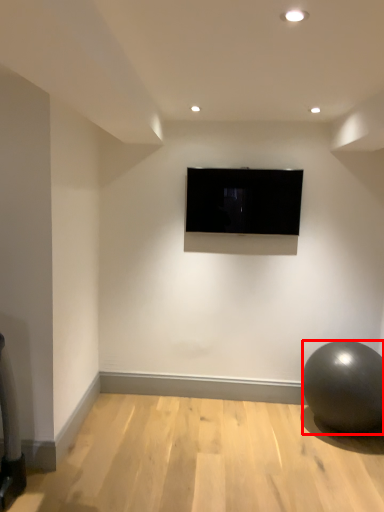
Question: From the image's perspective, considering the relative positions of ball (annotated by the red box) and television in the image provided, where is ball (annotated by the red box) located with respect to the staircase?

Choices:
 (A) below
 (B) above

Answer: (A)